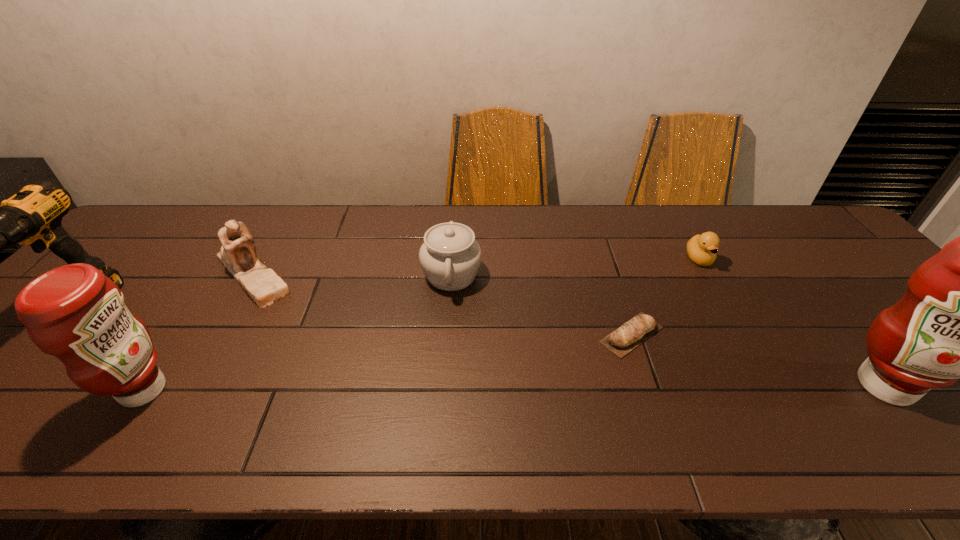
Image resolution: width=960 pixels, height=540 pixels. Identify the location of vacant region that satisfies the following two spatial constraints: 1. on the front-facing side of the chinaware; 2. on the right side of the figurine. (252, 275).